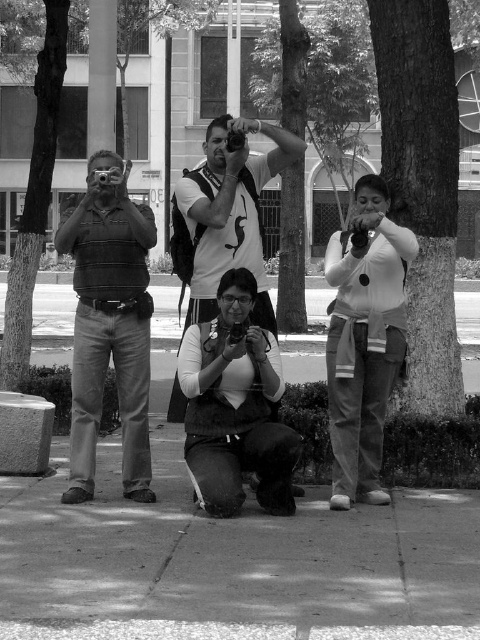
Consider the image. Does rough bark tree at right have a greater width compared to matte black camera at center?

No, rough bark tree at right is not wider than matte black camera at center.

Between point (380, 12) and point (288, 500), which one is positioned in front?

Positioned in front is point (288, 500).

Who is more forward, (417, 179) or (205, 449)?

Point (205, 449)

The image size is (480, 640). Identify the location of rough bark tree at right. (422, 186).

Does rough bark tree at right have a greater width compared to smooth bark tree at left?

No.

Which is in front, point (408, 147) or point (24, 260)?

Point (408, 147) is more forward.

Where is `rough bark tree at right`? The image size is (480, 640). rough bark tree at right is located at coordinates (422, 186).

Who is more forward, (x=416, y=13) or (x=377, y=212)?

Point (x=377, y=212) is in front.

Consider the image. Can you confirm if rough bark tree at right is positioned to the left of matte white shirt at center?

In fact, rough bark tree at right is to the right of matte white shirt at center.

Is point (455, 381) more distant than point (337, 358)?

Yes, point (455, 381) is farther from viewer.

Where is `rough bark tree at right`? This screenshot has width=480, height=640. rough bark tree at right is located at coordinates (422, 186).